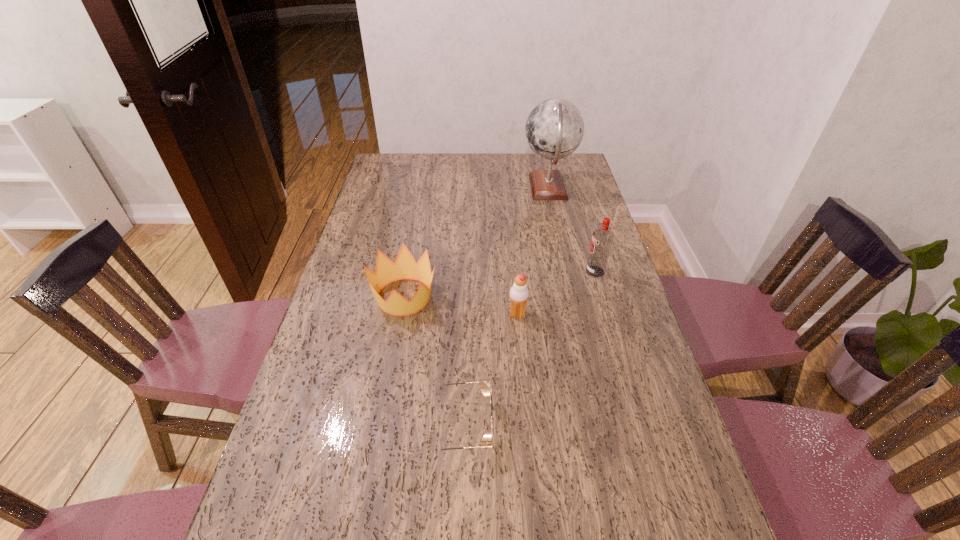
The image size is (960, 540). Identify the location of the tallest object. (554, 129).

Image resolution: width=960 pixels, height=540 pixels. Identify the location of the farthest object. (554, 129).

You are a GUI agent. You are given a task and a screenshot of the screen. Output one action in this format:
    pyautogui.click(x=<x>, y=<y>)
    Task: Click on the second tallest object
    This screenshot has width=960, height=540.
    Given the screenshot: What is the action you would take?
    click(602, 239)

Where is `the third shortest object`? The image size is (960, 540). the third shortest object is located at coordinates (519, 293).

Find the location of `icecream`. icecream is located at coordinates (519, 293).

Identify the location of the fourth tallest object. Image resolution: width=960 pixels, height=540 pixels. (405, 267).

The height and width of the screenshot is (540, 960). What are the coordinates of `crown` in the screenshot? It's located at (405, 267).

I want to click on the shortest object, so click(x=485, y=387).

Locate an element on the screen. sunglasses is located at coordinates (485, 387).

Locate an element on the screen. This screenshot has width=960, height=540. vacant position located at the equator of the globe is located at coordinates (479, 188).